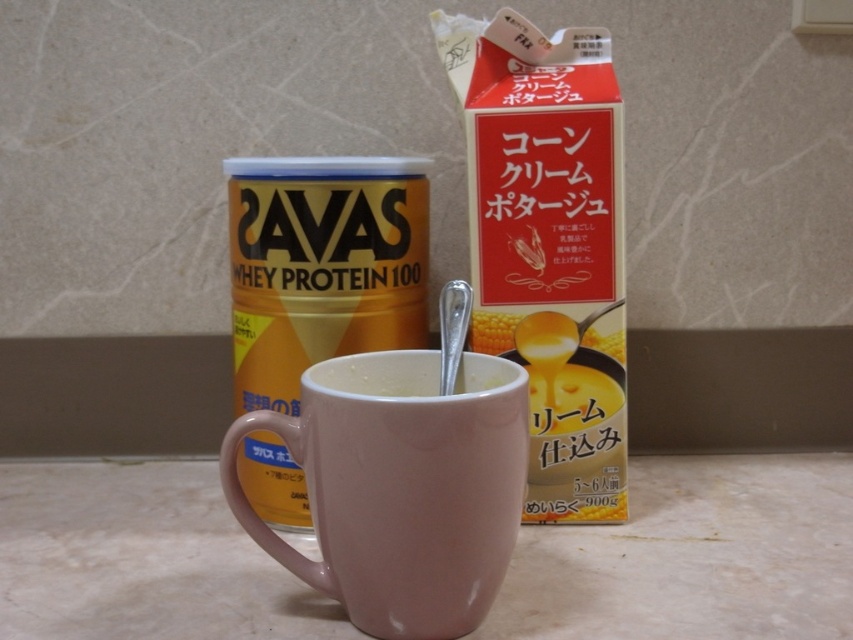
Between point (496, 422) and point (485, 381), which one is positioned behind?

The point (485, 381) is behind.

Is pink glossy mug at center bigger than white matte mug at center?

Indeed, pink glossy mug at center has a larger size compared to white matte mug at center.

This screenshot has height=640, width=853. What do you see at coordinates (399, 486) in the screenshot?
I see `pink glossy mug at center` at bounding box center [399, 486].

Where is `pink glossy mug at center`? The image size is (853, 640). pink glossy mug at center is located at coordinates (399, 486).

Can you confirm if matte ceramic mug at center is positioned above white matte mug at center?

Yes.

Does matte ceramic mug at center lie in front of white matte mug at center?

No, it is not.

Which is in front, point (279, 324) or point (325, 371)?

Point (325, 371) is more forward.

The width and height of the screenshot is (853, 640). Identify the location of matte ceramic mug at center. (322, 266).

Can you confirm if pink glossy mug at center is bigger than matte ceramic mug at center?

No.

Is pink glossy mug at center smaller than matte ceramic mug at center?

Yes, pink glossy mug at center is smaller than matte ceramic mug at center.

Who is more distant from viewer, [494,387] or [252,269]?

Positioned behind is point [252,269].

Where is `pink glossy mug at center`? pink glossy mug at center is located at coordinates (399, 486).